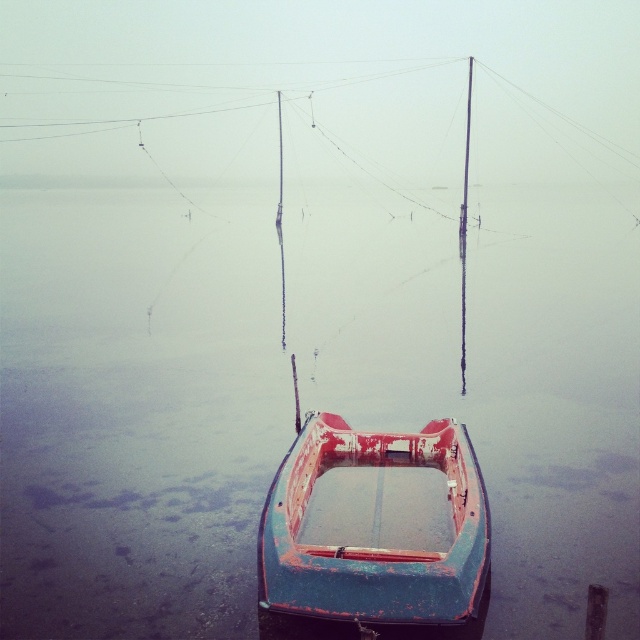
Can you confirm if rusty metal water at center is taller than rusty metal boat at center?

Yes.

This screenshot has width=640, height=640. I want to click on rusty metal water at center, so click(x=304, y=394).

Does point (564, 268) come closer to viewer compared to point (410, 580)?

No.

Locate an element on the screen. This screenshot has width=640, height=640. rusty metal water at center is located at coordinates (304, 394).